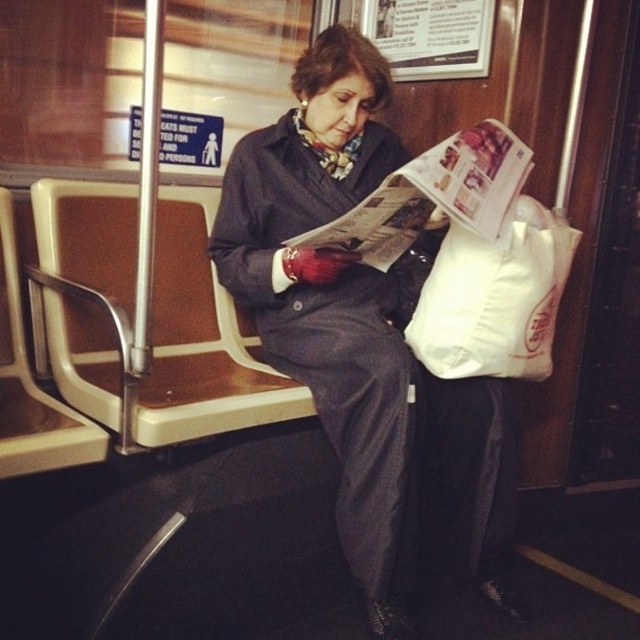
Question: Is matte black coat at center to the right of white paper bag at right from the viewer's perspective?

Choices:
 (A) no
 (B) yes

Answer: (A)

Question: Which point is farther from the camera taking this photo?

Choices:
 (A) (513, 205)
 (B) (387, 364)

Answer: (A)

Question: Is matte black coat at center further to camera compared to white paper bag at right?

Choices:
 (A) yes
 (B) no

Answer: (B)

Question: Is matte black coat at center to the left of white paper bag at right from the viewer's perspective?

Choices:
 (A) no
 (B) yes

Answer: (B)

Question: Which object appears farthest from the camera in this image?

Choices:
 (A) matte black coat at center
 (B) white paper bag at right

Answer: (B)